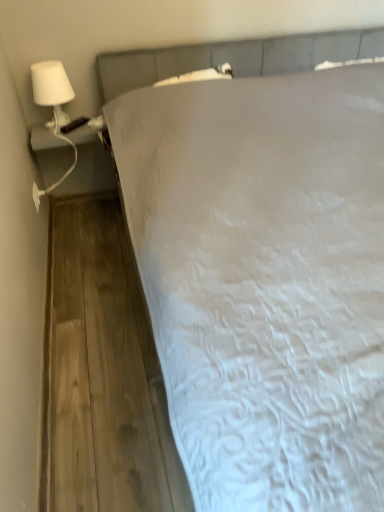
What is the approximate width of white matte lamp at upper left?

It is 7.40 inches.

Find the location of `white matte lamp at upper left`. white matte lamp at upper left is located at coordinates click(52, 90).

Describe the element at coordinates (52, 90) in the screenshot. I see `white matte lamp at upper left` at that location.

This screenshot has width=384, height=512. What do you see at coordinates (264, 280) in the screenshot?
I see `white textured bed at center` at bounding box center [264, 280].

The height and width of the screenshot is (512, 384). In order to click on white textured bed at center in this screenshot , I will do `click(264, 280)`.

Find the location of a particular element. This screenshot has height=512, width=384. white matte lamp at upper left is located at coordinates (52, 90).

Which is more to the right, white textured bed at center or white matte lamp at upper left?

white textured bed at center is more to the right.

Who is more distant, white textured bed at center or white matte lamp at upper left?

white matte lamp at upper left is further away from the camera.

Considering the points (381, 234) and (58, 108), which point is in front, point (381, 234) or point (58, 108)?

Point (381, 234)

From the image's perspective, which is above, white textured bed at center or white matte lamp at upper left?

From the image's view, white matte lamp at upper left is above.

From a real-world perspective, who is located lower, white textured bed at center or white matte lamp at upper left?

white textured bed at center is physically lower.

Between white textured bed at center and white matte lamp at upper left, which one has smaller width?

white matte lamp at upper left.

Consider the image. Does white textured bed at center have a lesser height compared to white matte lamp at upper left?

In fact, white textured bed at center may be taller than white matte lamp at upper left.

From the picture: Looking at the image, does white textured bed at center seem bigger or smaller compared to white matte lamp at upper left?

Clearly, white textured bed at center is larger in size than white matte lamp at upper left.

Is white textured bed at center not inside white matte lamp at upper left?

That's correct, white textured bed at center is outside of white matte lamp at upper left.

In the scene shown: Is white textured bed at center far away from white matte lamp at upper left?

No.

Is white textured bed at center facing towards white matte lamp at upper left?

No, white textured bed at center is not facing towards white matte lamp at upper left.

Find the location of a particular element. The width and height of the screenshot is (384, 512). bed on the right of white matte lamp at upper left is located at coordinates (264, 280).

From the picture: Can you confirm if white matte lamp at upper left is positioned to the right of white textured bed at center?

Incorrect, white matte lamp at upper left is not on the right side of white textured bed at center.

Is the depth of white matte lamp at upper left greater than that of white textured bed at center?

Yes, white matte lamp at upper left is behind white textured bed at center.

Does point (55, 94) appear closer or farther from the camera than point (212, 48)?

Point (55, 94) appears to be closer to the viewer than point (212, 48).

From the image's perspective, is white matte lamp at upper left above or below white textured bed at center?

Based on their image positions, white matte lamp at upper left is located above white textured bed at center.

From a real-world perspective, is white matte lamp at upper left above or below white textured bed at center?

white matte lamp at upper left is situated higher than white textured bed at center in the real world.

Considering the sizes of white matte lamp at upper left and white textured bed at center in the image, is white matte lamp at upper left wider or thinner than white textured bed at center?

Considering their sizes, white matte lamp at upper left looks slimmer than white textured bed at center.

Considering the relative sizes of white matte lamp at upper left and white textured bed at center in the image provided, is white matte lamp at upper left taller than white textured bed at center?

No.

Who is smaller, white matte lamp at upper left or white textured bed at center?

With smaller size is white matte lamp at upper left.

Do you think white matte lamp at upper left is within white textured bed at center, or outside of it?

white matte lamp at upper left is spatially situated outside white textured bed at center.

Are white matte lamp at upper left and white textured bed at center located far from each other?

That's not correct — white matte lamp at upper left is a little close to white textured bed at center.

Is white matte lamp at upper left looking in the opposite direction of white textured bed at center?

No, white matte lamp at upper left's orientation is not away from white textured bed at center.

Can you tell me how much white matte lamp at upper left and white textured bed at center differ in facing direction?

2.13 degrees separate the facing orientations of white matte lamp at upper left and white textured bed at center.

Find the location of a particular element. The width and height of the screenshot is (384, 512). bed below the white matte lamp at upper left (from the image's perspective) is located at coordinates (264, 280).

You are a GUI agent. You are given a task and a screenshot of the screen. Output one action in this format:
    pyautogui.click(x=<x>, y=<y>)
    Task: Click on the bed that is on the right side of white matte lamp at upper left
    This screenshot has height=512, width=384.
    Given the screenshot: What is the action you would take?
    pyautogui.click(x=264, y=280)

The width and height of the screenshot is (384, 512). In order to click on lamp on the left of white textured bed at center in this screenshot , I will do `click(52, 90)`.